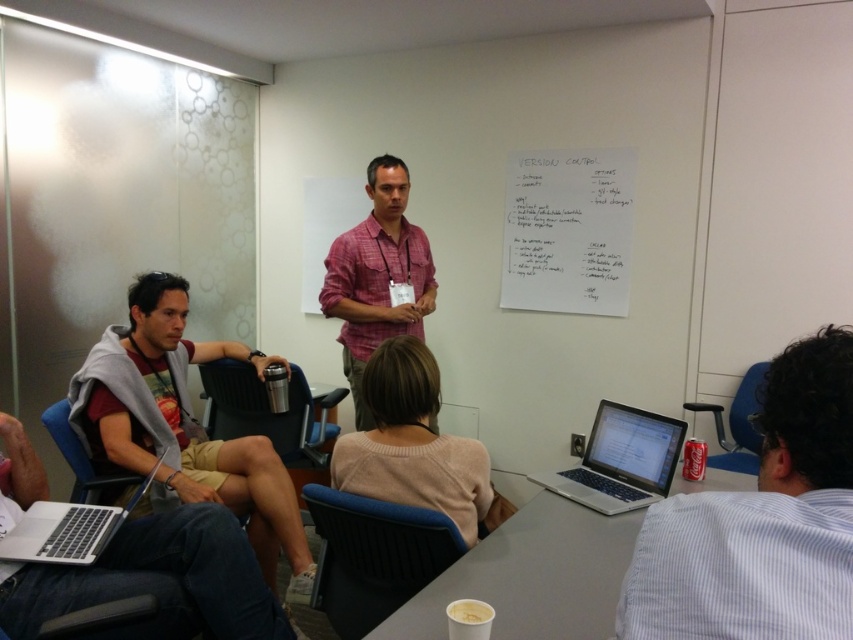
You are standing in the conference room and want to move from point (331, 524) to point (712, 460). Which direction should you move to get closer to the whiteboard at the back?

To move closer to the whiteboard at the back, you should move towards point (712, 460) because it is further away from the viewer compared to point (331, 524).

You are organizing a presentation and need to place a matte gray hoodie at left on a chair. Is the blue plastic chair at lower right the correct one to place it on?

The matte gray hoodie at left is positioned under blue plastic chair at lower right, so yes, the blue plastic chair at lower right is the correct one to place the matte gray hoodie at left on.

You are organizing a meeting in the conference room and need to seat two attendees. You have a blue fabric chair at center and a blue plastic chair at lower right. Based on their positions, which chair is closer to the whiteboard at the back?

The blue plastic chair at lower right is closer to the whiteboard at the back because the blue fabric chair at center is located below it, implying it is positioned further forward in the room.